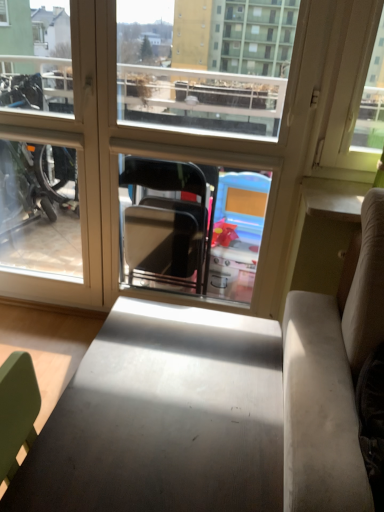
Question: From the image's perspective, is matte gray table at center positioned above or below transparent glass window at center?

Choices:
 (A) below
 (B) above

Answer: (A)

Question: Considering the positions of matte gray table at center and transparent glass window at center in the image, is matte gray table at center bigger or smaller than transparent glass window at center?

Choices:
 (A) big
 (B) small

Answer: (A)

Question: Considering their positions, is matte gray table at center located in front of or behind transparent glass window at center?

Choices:
 (A) behind
 (B) front

Answer: (B)

Question: Which is correct: transparent glass window at center is inside matte gray table at center, or outside of it?

Choices:
 (A) outside
 (B) inside

Answer: (A)

Question: In terms of width, does transparent glass window at center look wider or thinner when compared to matte gray table at center?

Choices:
 (A) wide
 (B) thin

Answer: (B)

Question: In terms of height, does transparent glass window at center look taller or shorter compared to matte gray table at center?

Choices:
 (A) short
 (B) tall

Answer: (B)

Question: Would you say transparent glass window at center is to the left or to the right of matte gray table at center in the picture?

Choices:
 (A) left
 (B) right

Answer: (A)